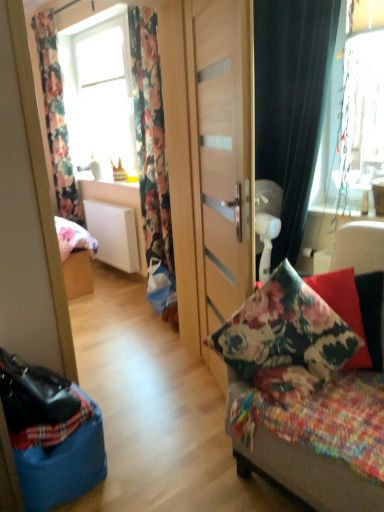
Question: From their relative heights in the image, would you say floral fabric cushion at center is taller or shorter than wooden door at center?

Choices:
 (A) short
 (B) tall

Answer: (A)

Question: Visually, is floral fabric cushion at center positioned to the left or to the right of wooden door at center?

Choices:
 (A) left
 (B) right

Answer: (B)

Question: Based on their relative distances, which object is nearer to the white matte radiator at center?

Choices:
 (A) floral fabric curtain at upper left, the 1th curtain viewed from the left
 (B) wooden door at center
 (C) floral fabric pillow at right
 (D) floral fabric curtain at left, the 2th curtain viewed from the left
 (E) fluffy multicolored blanket at right

Answer: (D)

Question: Which is nearer to the transparent glass window at upper right, the first window in the front-to-back sequence?

Choices:
 (A) wooden door at center
 (B) black velvet curtain at right, the 1th curtain viewed from the front
 (C) floral fabric curtain at upper left, the 1th curtain viewed from the left
 (D) floral fabric curtain at left, the 2th curtain positioned from the front
 (E) floral fabric pillow at right

Answer: (B)